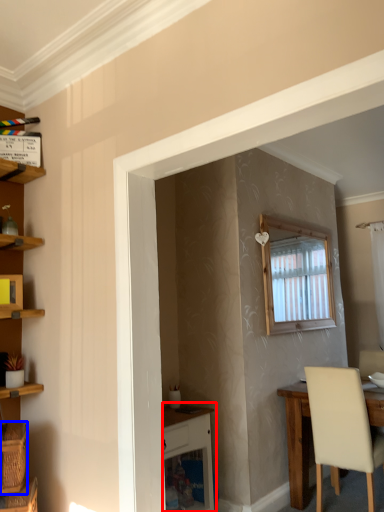
Question: Which point is further to the camera, vanity (highlighted by a red box) or basket (highlighted by a blue box)?

Choices:
 (A) vanity
 (B) basket

Answer: (A)